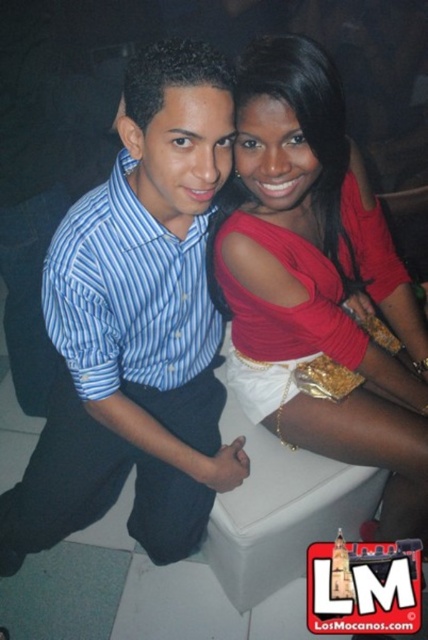
Find the location of `matte red blouse at center`. matte red blouse at center is located at coordinates (318, 284).

You are a GUI agent. You are given a task and a screenshot of the screen. Output one action in this format:
    pyautogui.click(x=<x>, y=<y>)
    Task: Click on the matte red blouse at center
    This screenshot has width=428, height=640.
    Given the screenshot: What is the action you would take?
    tap(318, 284)

At what (x,y) coordinates should I click in order to perform the action: click on matte red blouse at center. Please return your answer as a coordinate pair (x, y). Looking at the image, I should click on (318, 284).